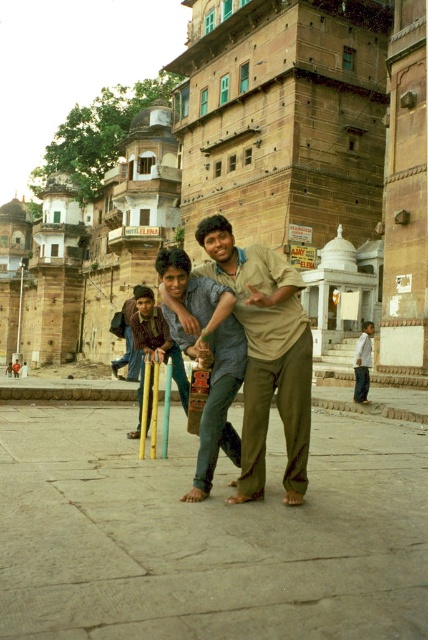
Question: Where is brown cotton shirt at center located in relation to blue denim jeans at center in the image?

Choices:
 (A) right
 (B) left

Answer: (A)

Question: Does light brown cotton shirt at center have a larger size compared to white cotton shirt at lower right?

Choices:
 (A) yes
 (B) no

Answer: (B)

Question: Which of these objects is positioned farthest from the blue denim jeans at center?

Choices:
 (A) brown cotton shirt at center
 (B) white cotton shirt at lower right
 (C) light brown cotton shirt at center

Answer: (A)

Question: Which object is farther from the camera taking this photo?

Choices:
 (A) brown cotton shirt at center
 (B) wooden cricket bats at center
 (C) light brown cotton shirt at center
 (D) white cotton shirt at lower right

Answer: (D)

Question: Which of the following is the closest to the observer?

Choices:
 (A) (210, 272)
 (B) (148, 349)
 (C) (127, 374)
 (D) (208, 420)

Answer: (D)

Question: Can you confirm if light brown cotton shirt at center is positioned above wooden cricket bats at center?

Choices:
 (A) no
 (B) yes

Answer: (B)